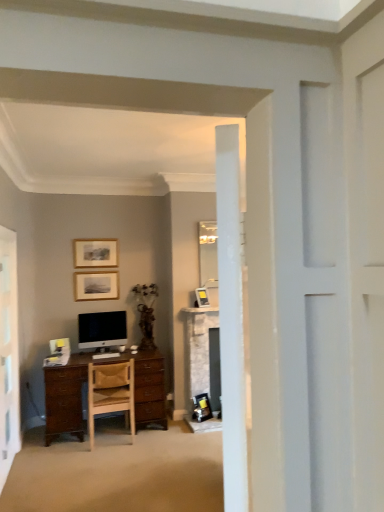
Question: Is wooden picture frame at upper center, the 3th picture frame from the bottom, wider than matte silver picture frame at center, which is the third picture frame in top-to-bottom order?

Choices:
 (A) no
 (B) yes

Answer: (A)

Question: Is wooden picture frame at upper center, the 3th picture frame from the bottom, further to the viewer compared to matte silver picture frame at center, arranged as the third picture frame when viewed from the left?

Choices:
 (A) no
 (B) yes

Answer: (B)

Question: Considering the relative sizes of wooden picture frame at upper center, the 3th picture frame from the bottom, and matte silver picture frame at center, which is the third picture frame in top-to-bottom order, in the image provided, is wooden picture frame at upper center, the 3th picture frame from the bottom, shorter than matte silver picture frame at center, which is the third picture frame in top-to-bottom order,?

Choices:
 (A) no
 (B) yes

Answer: (A)

Question: From a real-world perspective, does wooden picture frame at upper center, the 3th picture frame from the bottom, sit lower than matte silver picture frame at center, which ranks as the 1th picture frame in right-to-left order?

Choices:
 (A) no
 (B) yes

Answer: (A)

Question: Considering the relative sizes of wooden picture frame at upper center, the first picture frame from the top, and matte silver picture frame at center, acting as the first picture frame starting from the bottom, in the image provided, is wooden picture frame at upper center, the first picture frame from the top, smaller than matte silver picture frame at center, acting as the first picture frame starting from the bottom,?

Choices:
 (A) no
 (B) yes

Answer: (A)

Question: From a real-world perspective, is matte silver picture frame at center, arranged as the third picture frame when viewed from the left, physically located above or below white glossy screen door at left?

Choices:
 (A) below
 (B) above

Answer: (B)

Question: From the image's perspective, is matte silver picture frame at center, which ranks as the 1th picture frame in right-to-left order, above or below white glossy screen door at left?

Choices:
 (A) below
 (B) above

Answer: (B)

Question: Looking at their shapes, would you say matte silver picture frame at center, which is the third picture frame in top-to-bottom order, is wider or thinner than white glossy screen door at left?

Choices:
 (A) thin
 (B) wide

Answer: (B)

Question: Looking at the image, does matte silver picture frame at center, acting as the first picture frame starting from the bottom, seem bigger or smaller compared to white glossy screen door at left?

Choices:
 (A) big
 (B) small

Answer: (B)

Question: Visually, is satin black monitor at center positioned to the left or to the right of matte silver picture frame at center, arranged as the third picture frame when viewed from the left?

Choices:
 (A) right
 (B) left

Answer: (B)

Question: Is satin black monitor at center inside or outside of matte silver picture frame at center, arranged as the third picture frame when viewed from the left?

Choices:
 (A) outside
 (B) inside

Answer: (A)

Question: From a real-world perspective, is satin black monitor at center above or below matte silver picture frame at center, acting as the first picture frame starting from the bottom?

Choices:
 (A) above
 (B) below

Answer: (B)

Question: In the image, is satin black monitor at center positioned in front of or behind matte silver picture frame at center, which ranks as the 1th picture frame in right-to-left order?

Choices:
 (A) front
 (B) behind

Answer: (A)

Question: In the image, is satin black monitor at center positioned in front of or behind matte gold picture frame at upper center, which ranks as the second picture frame in bottom-to-top order?

Choices:
 (A) front
 (B) behind

Answer: (A)

Question: Does point pyautogui.click(x=99, y=313) appear closer or farther from the camera than point pyautogui.click(x=91, y=275)?

Choices:
 (A) farther
 (B) closer

Answer: (B)